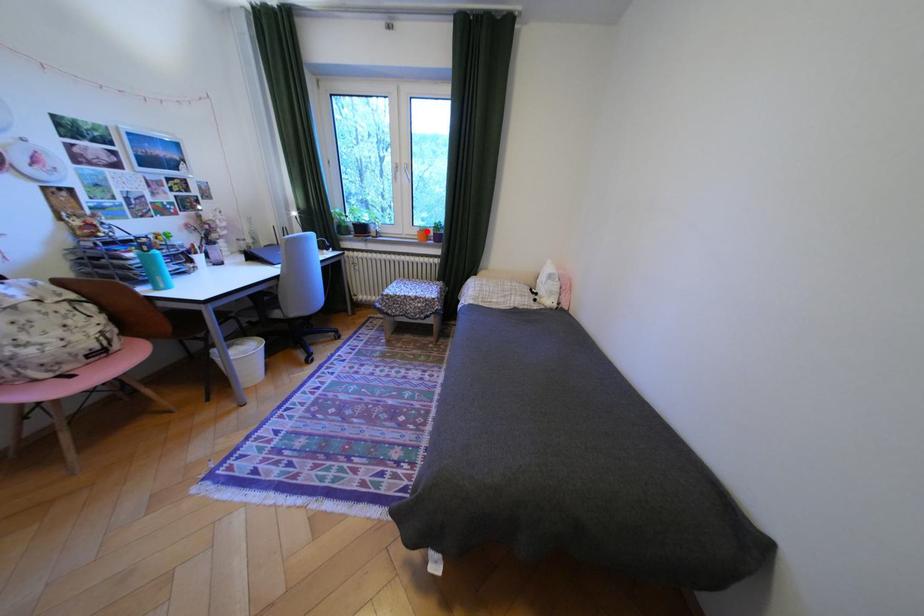
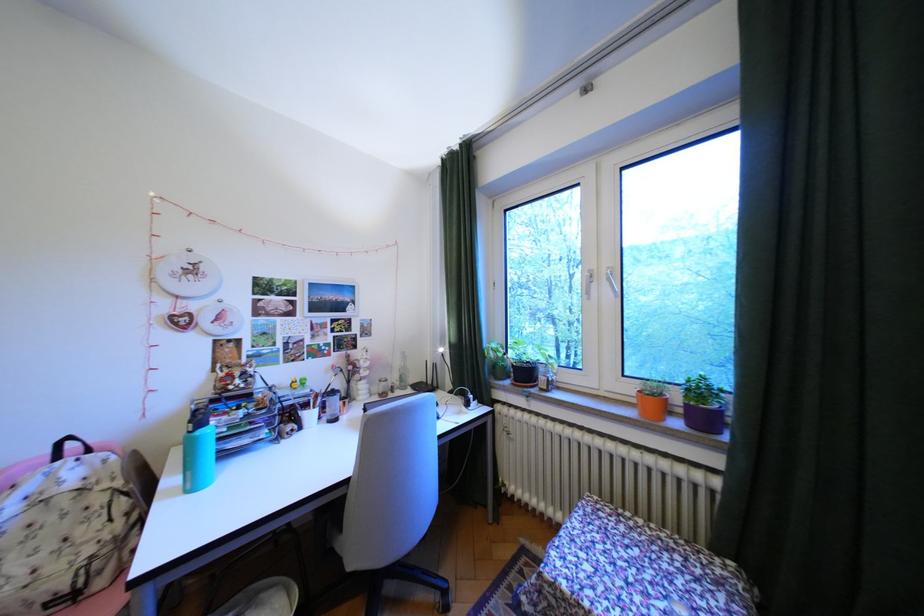
Question: A red point is marked in image1. In image2, is the corresponding 3D point closer to the camera or farther? Reply with the corresponding letter.

Choices:
 (A) The corresponding 3D point is closer.
 (B) The corresponding 3D point is farther.

Answer: (B)